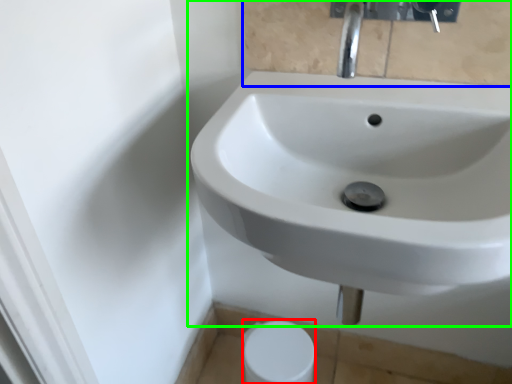
Question: Which object is the closest to the toilet paper (highlighted by a red box)? Choose among these: mirror (highlighted by a blue box) or sink (highlighted by a green box).

Choices:
 (A) mirror
 (B) sink

Answer: (B)